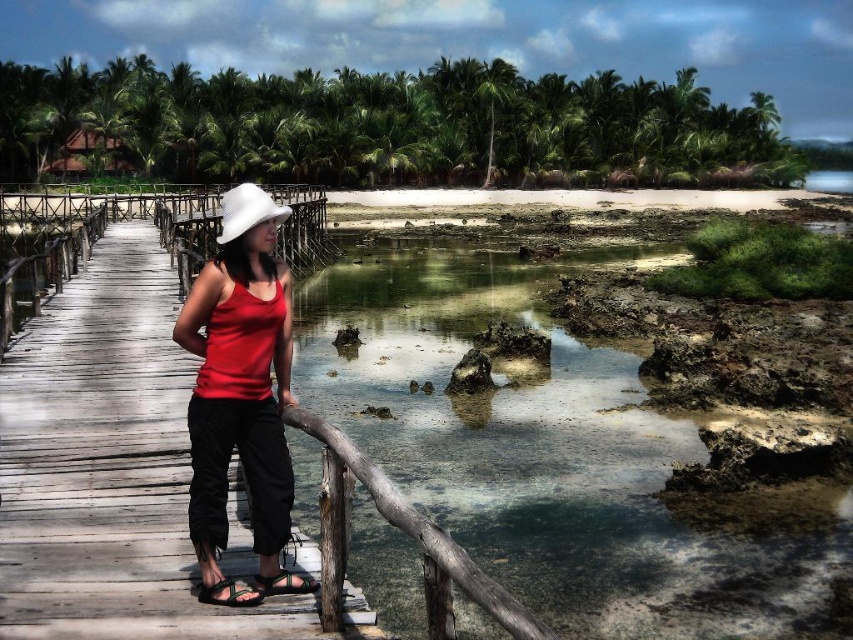
Question: Which of the following is the farthest from the observer?

Choices:
 (A) black fabric sandal at lower center
 (B) white felt hat at center
 (C) matte red tank top at center
 (D) wooden dock at center

Answer: (A)

Question: Which of these objects is positioned farthest from the green fabric sandal at lower center?

Choices:
 (A) black fabric sandal at lower center
 (B) matte red tank top at center
 (C) white felt hat at center

Answer: (C)

Question: Is wooden dock at center above green fabric sandal at lower center?

Choices:
 (A) no
 (B) yes

Answer: (B)

Question: Does matte red tank top at center lie behind green fabric sandal at lower center?

Choices:
 (A) no
 (B) yes

Answer: (A)

Question: Among these points, which one is farthest from the camera?

Choices:
 (A) (235, 598)
 (B) (260, 576)
 (C) (271, 406)

Answer: (B)

Question: Can you confirm if wooden dock at center is positioned to the left of white felt hat at center?

Choices:
 (A) yes
 (B) no

Answer: (A)